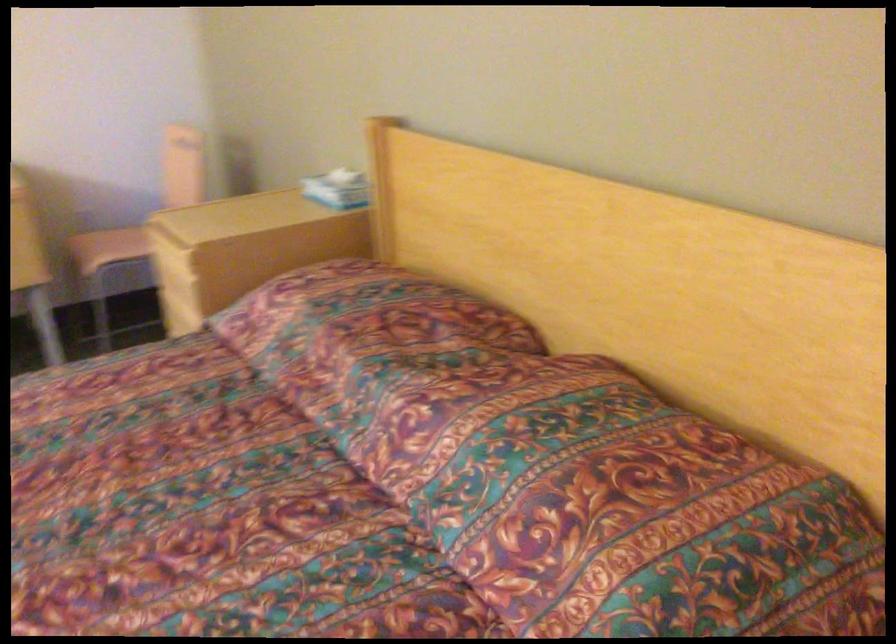
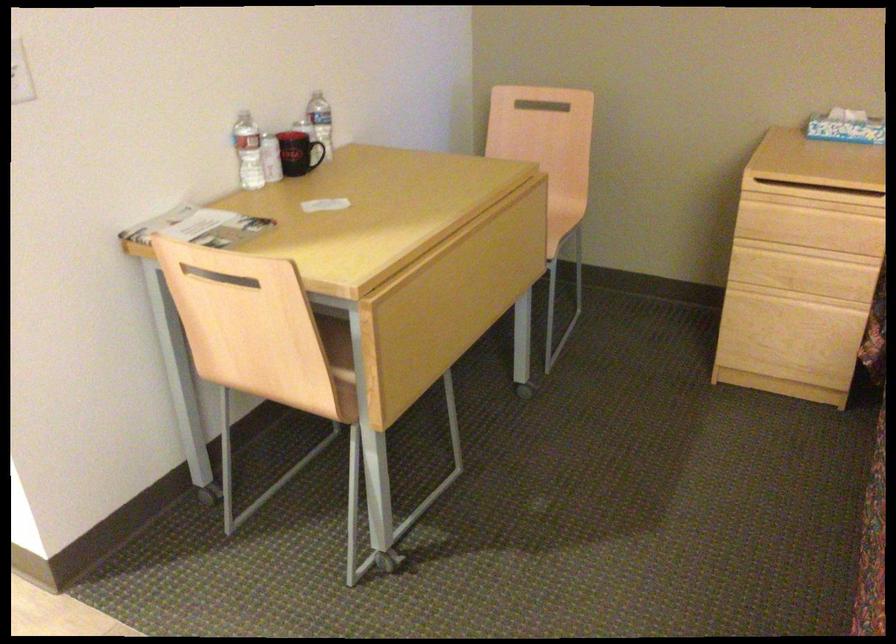
The point at (177, 298) is marked in the first image. Where is the corresponding point in the second image?

(810, 251)